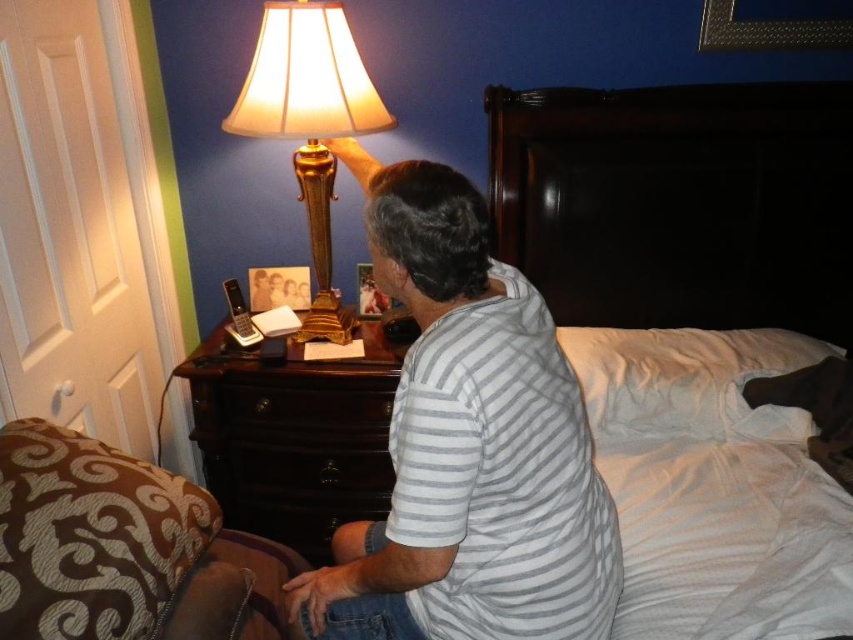
You are organizing items on the nightstand in the bedroom. You need to place a new book between the brown textured fabric at lower left and the gold metallic lamp at upper left. Based on their positions, where should you place the book?

The brown textured fabric at lower left is below the gold metallic lamp at upper left, so you should place the book between them by positioning it above the brown textured fabric at lower left and below the gold metallic lamp at upper left.